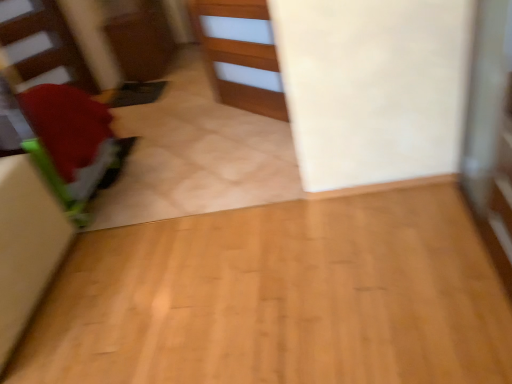
Where is `free spot behind wooden cabinet at center`? free spot behind wooden cabinet at center is located at coordinates [x=208, y=107].